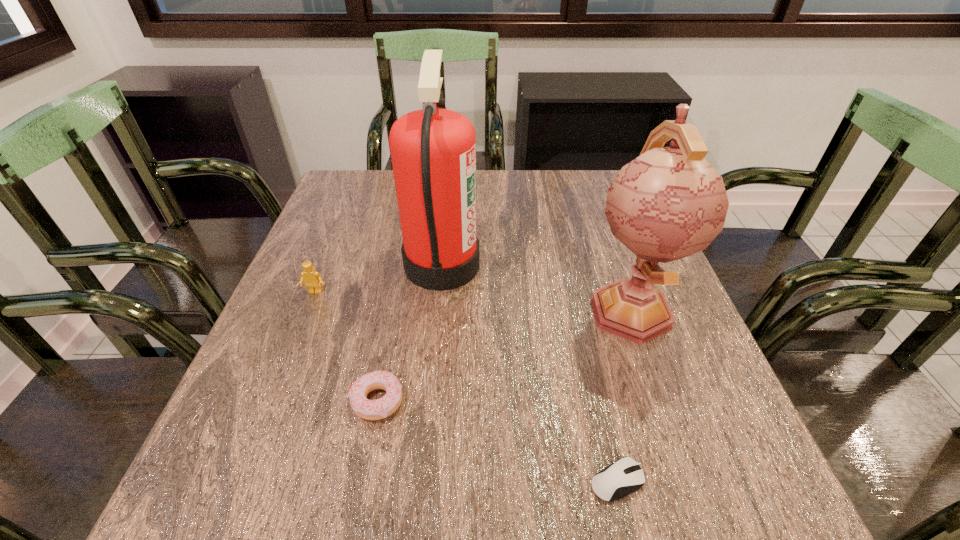
You are a GUI agent. You are given a task and a screenshot of the screen. Output one action in this format:
    pyautogui.click(x=<x>, y=<y>)
    Task: Click on the vacant space that satisfies the following two spatial constraints: 1. on the face of the Lego; 2. on the left side of the shortest object
    The width and height of the screenshot is (960, 540).
    Given the screenshot: What is the action you would take?
    pyautogui.click(x=240, y=481)

Find the location of a particular element. vacant space that satisfies the following two spatial constraints: 1. on the face of the second shortest object; 2. on the right side of the third tallest object is located at coordinates (272, 400).

You are a GUI agent. You are given a task and a screenshot of the screen. Output one action in this format:
    pyautogui.click(x=<x>, y=<y>)
    Task: Click on the vacant region that satisfies the following two spatial constraints: 1. on the face of the Lego; 2. on the right side of the second shortest object
    
    Given the screenshot: What is the action you would take?
    pyautogui.click(x=272, y=400)